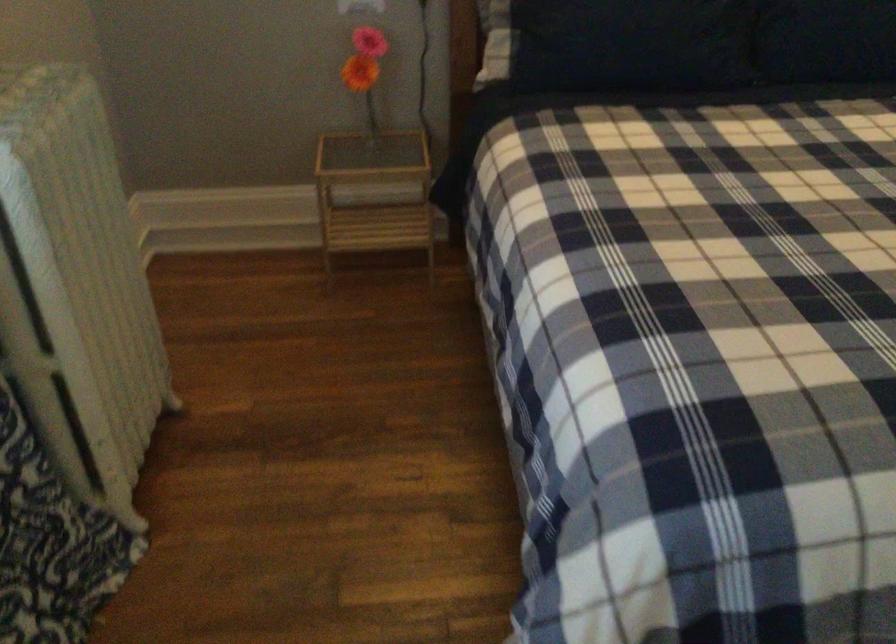
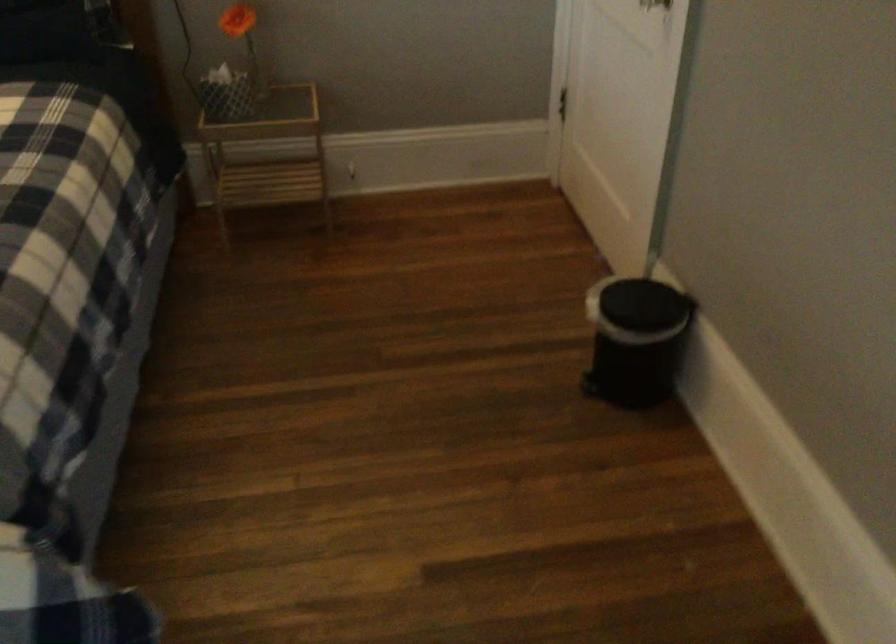
Question: Which direction would the cameraman need to move to produce the second image? Reply with the corresponding letter.

Choices:
 (A) Left
 (B) Right
 (C) Forward
 (D) Backward

Answer: (B)